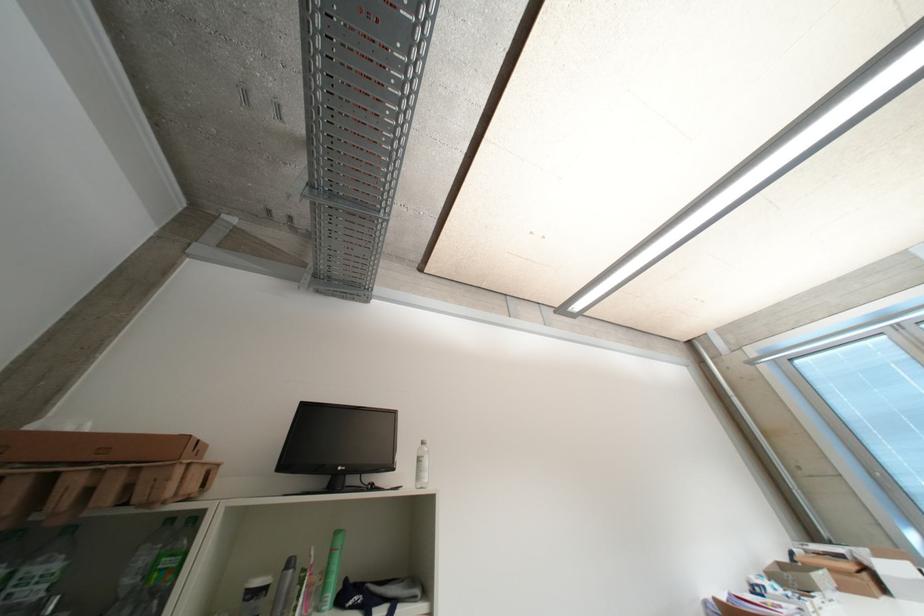
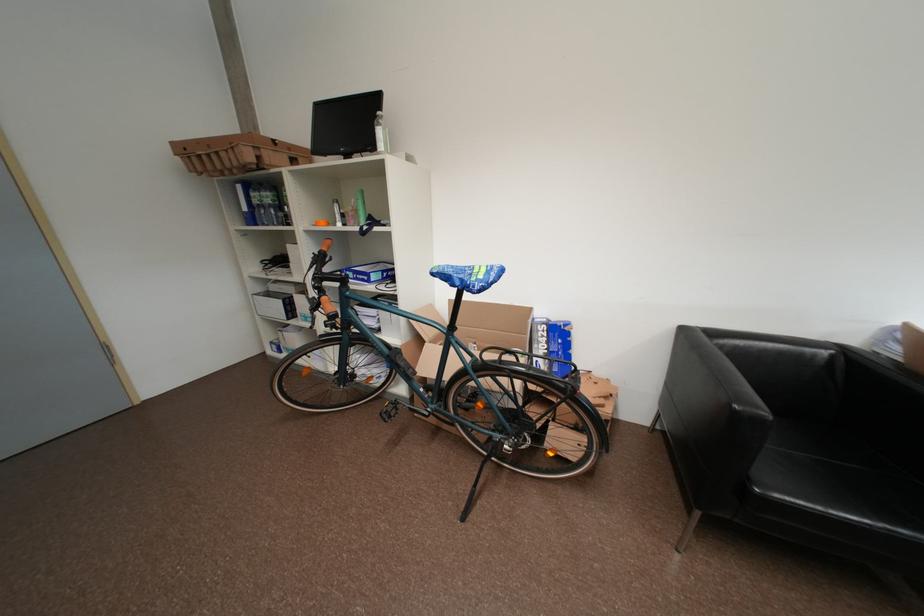
In the second image, find the point that corresponds to (x=334, y=576) in the first image.

(363, 213)